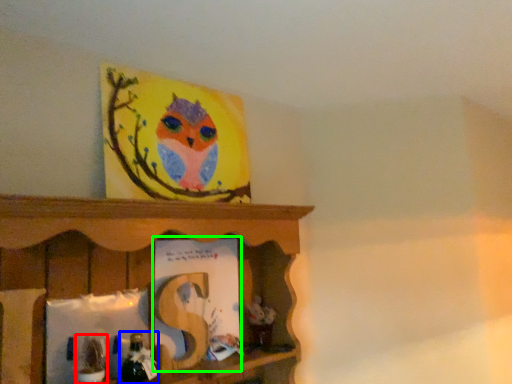
Question: Which object is the farthest from toy (highlighted by a red box)? Choose among these: toy (highlighted by a blue box) or book (highlighted by a green box).

Choices:
 (A) toy
 (B) book

Answer: (B)